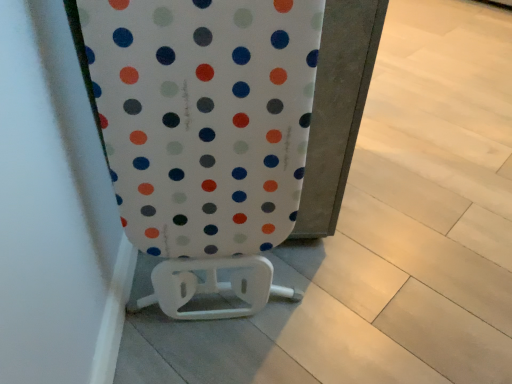
Where is `free spot below white plastic toilet at center (from a real-world perspective)`? Image resolution: width=512 pixels, height=384 pixels. free spot below white plastic toilet at center (from a real-world perspective) is located at coordinates (249, 312).